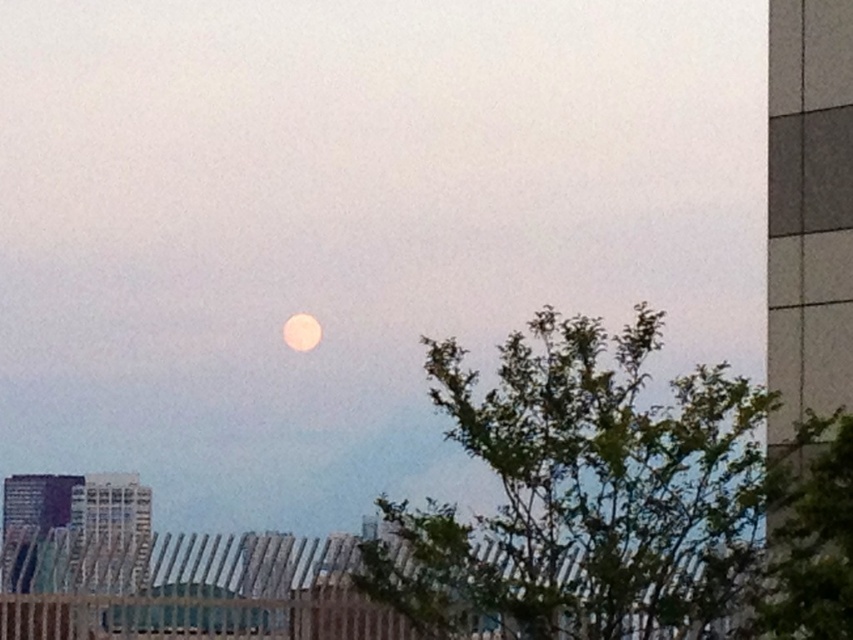
You are an astronomer observing the night sky and see the green leafy tree at center and the smooth white moon at center. Which object appears larger in the image?

The green leafy tree at center appears larger than the smooth white moon at center in the image.

You are an astronomer observing the night sky. You notice the green leafy tree at center and the smooth white moon at center. Which object appears closer to the horizon?

The green leafy tree at center is positioned under the smooth white moon at center, so the green leafy tree at center is closer to the horizon than the smooth white moon at center.

You are standing at the center of the image and want to walk towards the green leafy tree at center. In which direction should you move?

The green leafy tree at center is located at coordinates point (x=619, y=502), so you should move towards the lower right direction to reach it.